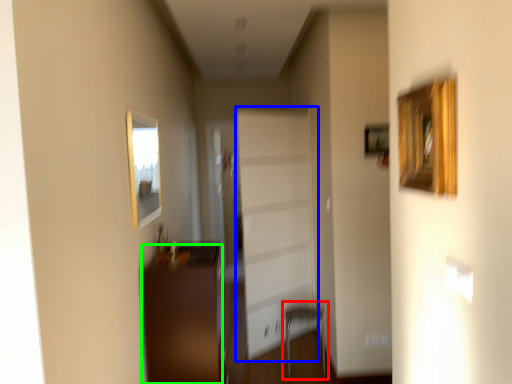
Question: Which object is the closest to the armchair (highlighted by a red box)? Choose among these: garage door (highlighted by a blue box) or furniture (highlighted by a green box).

Choices:
 (A) garage door
 (B) furniture

Answer: (A)